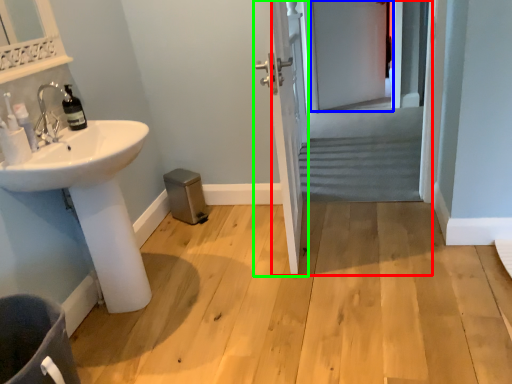
Question: Considering the real-world distances, which object is closest to screen door (highlighted by a red box)? screen door (highlighted by a blue box) or door (highlighted by a green box).

Choices:
 (A) screen door
 (B) door

Answer: (A)